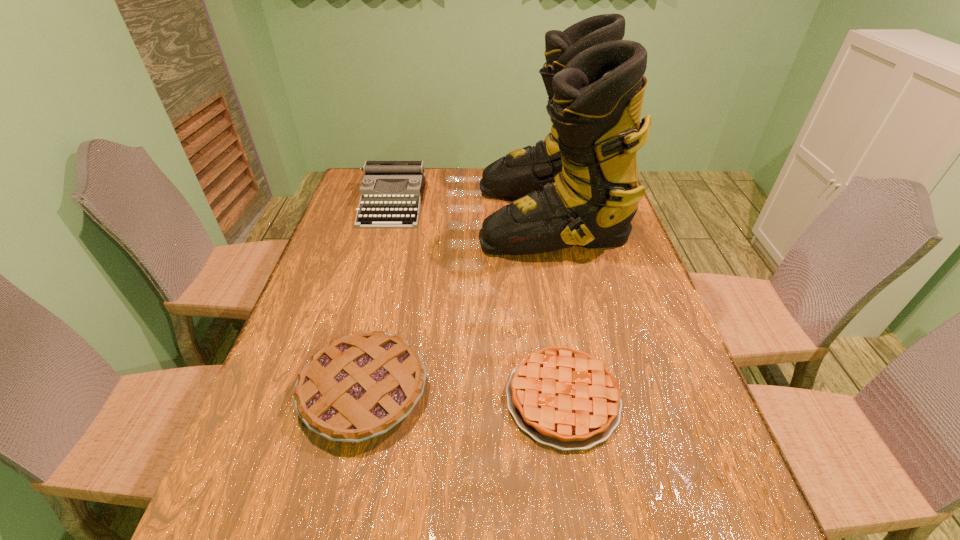
Choose which object is the nearest neighbor to the typewriter. Please provide its 2D coordinates. Your answer should be formatted as a tuple, i.e. [(x, y)], where the tuple contains the x and y coordinates of a point satisfying the conditions above.

[(579, 186)]

Image resolution: width=960 pixels, height=540 pixels. In order to click on object that is the second closest to the shorter pie in this screenshot , I will do `click(579, 186)`.

Where is `vacant space that satisfies the following two spatial constraints: 1. on the typing side of the typewriter; 2. on the right side of the left pie`? The image size is (960, 540). vacant space that satisfies the following two spatial constraints: 1. on the typing side of the typewriter; 2. on the right side of the left pie is located at coordinates (343, 392).

You are a GUI agent. You are given a task and a screenshot of the screen. Output one action in this format:
    pyautogui.click(x=<x>, y=<y>)
    Task: Click on the free space that satisfies the following two spatial constraints: 1. on the typing side of the second tallest object; 2. on the right side of the right pie
    The image size is (960, 540).
    Given the screenshot: What is the action you would take?
    pyautogui.click(x=341, y=399)

Find the location of a particular element. The image size is (960, 540). free spot that satisfies the following two spatial constraints: 1. on the typing side of the second tallest object; 2. on the left side of the taller pie is located at coordinates (343, 392).

What are the coordinates of `free space that satisfies the following two spatial constraints: 1. on the typing side of the shortest object; 2. on the left side of the typewriter` in the screenshot? It's located at (341, 399).

You are a GUI agent. You are given a task and a screenshot of the screen. Output one action in this format:
    pyautogui.click(x=<x>, y=<y>)
    Task: Click on the free location that satisfies the following two spatial constraints: 1. on the typing side of the second tallest object; 2. on the right side of the second shortest object
    
    Given the screenshot: What is the action you would take?
    pyautogui.click(x=343, y=392)

Where is `vacant space that satisfies the following two spatial constraints: 1. on the typing side of the typewriter; 2. on the left side of the taller pie`? The image size is (960, 540). vacant space that satisfies the following two spatial constraints: 1. on the typing side of the typewriter; 2. on the left side of the taller pie is located at coordinates (343, 392).